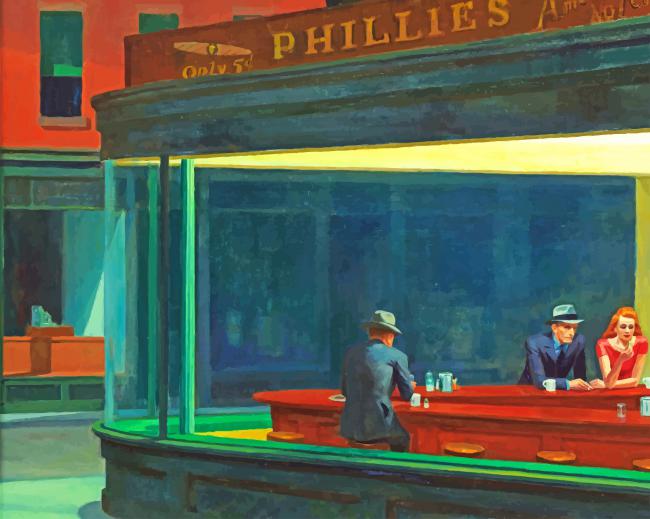
You are a GUI agent. You are given a task and a screenshot of the screen. Output one action in this format:
    pyautogui.click(x=<x>, y=<y>)
    Task: Click on the stools
    This screenshot has width=650, height=519.
    Given the screenshot: What is the action you would take?
    pyautogui.click(x=283, y=436), pyautogui.click(x=359, y=441), pyautogui.click(x=461, y=452), pyautogui.click(x=556, y=452), pyautogui.click(x=642, y=462)